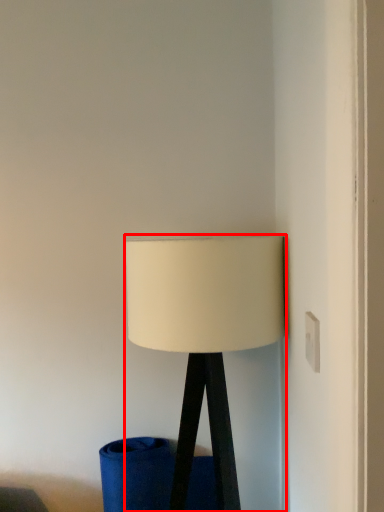
Question: Observing the image, what is the correct spatial positioning of lamp (annotated by the red box) in reference to electric outlet?

Choices:
 (A) right
 (B) left

Answer: (B)